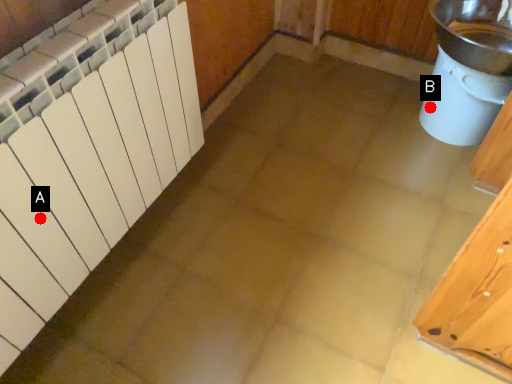
Question: Two points are circled on the image, labeled by A and B beside each circle. Which point is closer to the camera?

Choices:
 (A) A is closer
 (B) B is closer

Answer: (A)